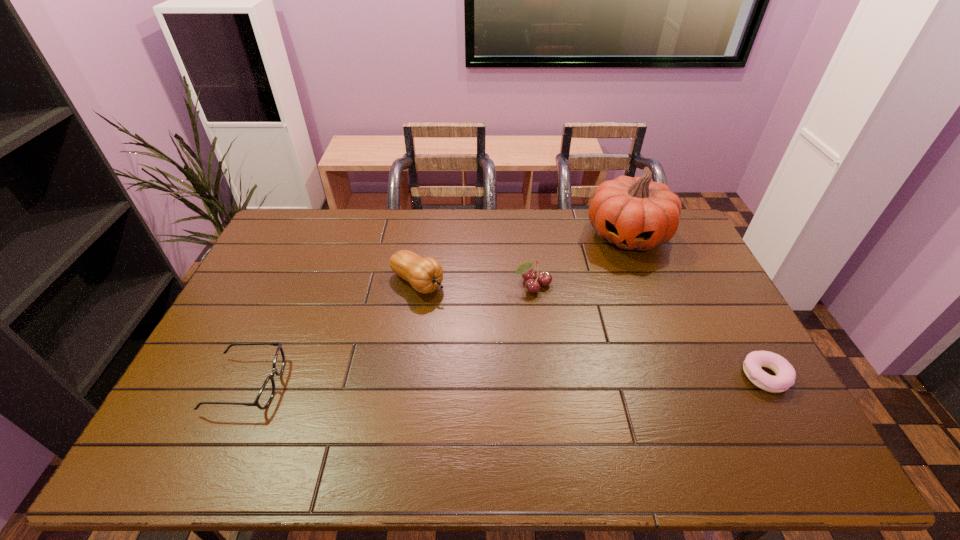
This screenshot has height=540, width=960. I want to click on vacant area between the doughnut and the third object from left to right, so click(x=649, y=331).

Image resolution: width=960 pixels, height=540 pixels. In order to click on the closest object relative to the pumpkin in this screenshot , I will do `click(544, 278)`.

The width and height of the screenshot is (960, 540). What are the coordinates of `object identified as the fourth closest to the farthest object` in the screenshot? It's located at (267, 391).

Locate an element on the screen. The height and width of the screenshot is (540, 960). free space that satisfies the following two spatial constraints: 1. on the front side of the third object from left to right; 2. on the right side of the gourd is located at coordinates (417, 286).